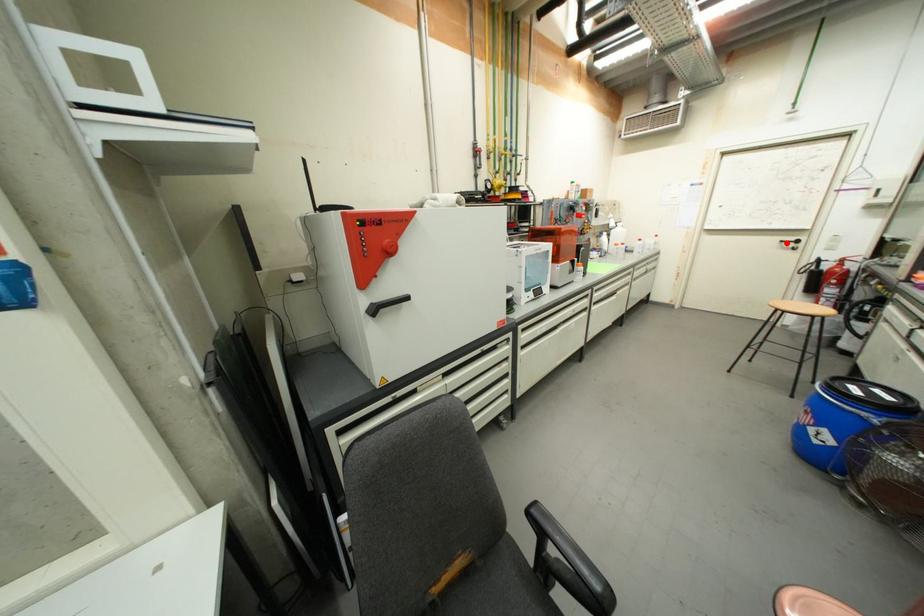
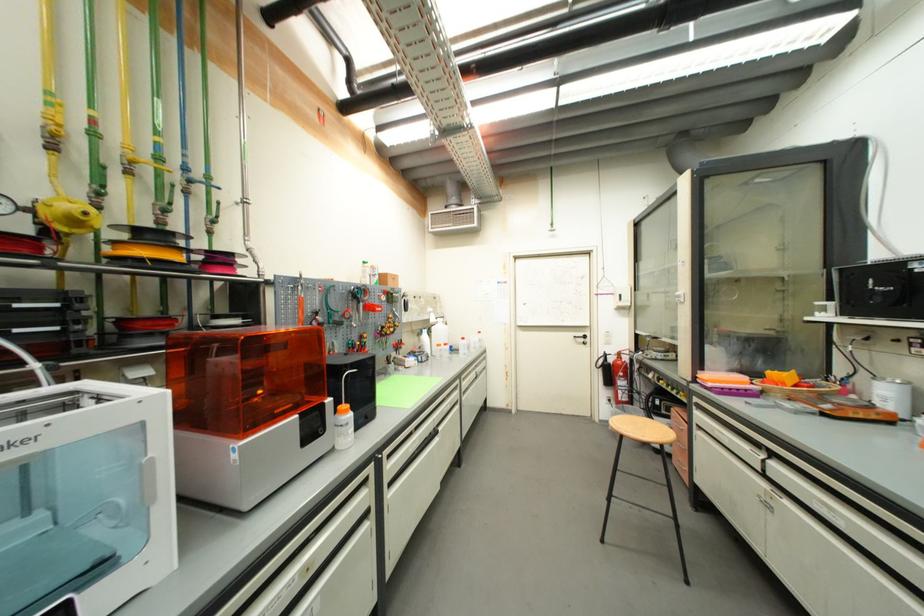
Question: I am providing you with two images of the same scene from different viewpoints. In image1, a red point is highlighted. Considering the same 3D point in image2, which of the following is correct?

Choices:
 (A) It is closer
 (B) It is farther

Answer: (B)